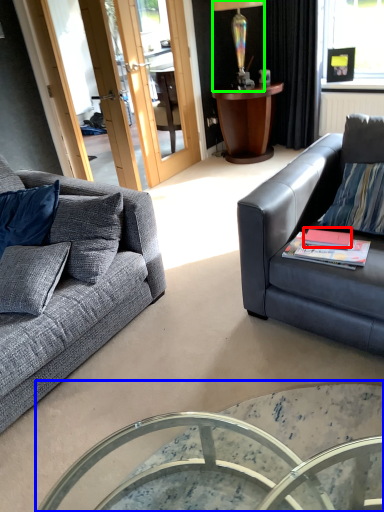
Question: Considering the real-world distances, which object is farthest from book (highlighted by a red box)? coffee table (highlighted by a blue box) or lamp (highlighted by a green box)?

Choices:
 (A) coffee table
 (B) lamp

Answer: (B)